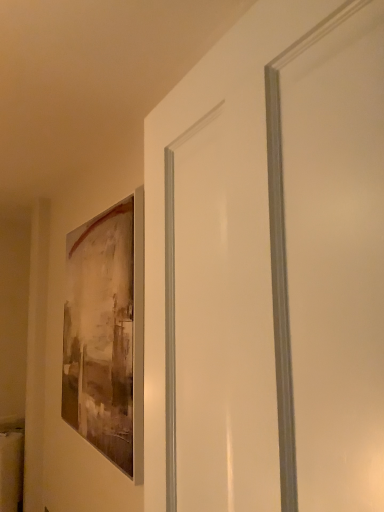
The width and height of the screenshot is (384, 512). Find the location of `matte brown painting at upper left`. matte brown painting at upper left is located at coordinates (107, 334).

What do you see at coordinates (107, 334) in the screenshot? I see `matte brown painting at upper left` at bounding box center [107, 334].

In order to click on matte brown painting at upper left in this screenshot , I will do `click(107, 334)`.